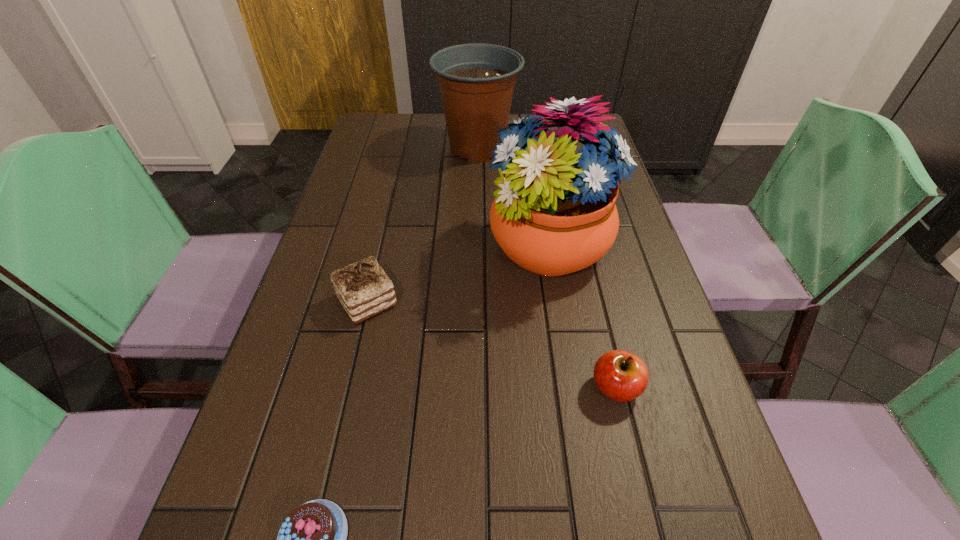
The image size is (960, 540). I want to click on object positioned at the left edge, so click(x=363, y=288).

The image size is (960, 540). I want to click on flower arrangement situated at the right edge, so click(554, 214).

Find the location of `apple that is positioned at the right edge`. apple that is positioned at the right edge is located at coordinates (621, 376).

You are a GUI agent. You are given a task and a screenshot of the screen. Output one action in this format:
    pyautogui.click(x=<x>, y=<y>)
    Task: Click on the vacant space at the far edge of the desktop
    The height and width of the screenshot is (540, 960).
    Given the screenshot: What is the action you would take?
    pyautogui.click(x=427, y=126)

Find the location of a particular element. Image resolution: width=960 pixels, height=540 pixels. free space at the left edge of the desktop is located at coordinates (276, 395).

I want to click on vacant space at the right edge, so click(607, 261).

At what (x,y) coordinates should I click in order to perform the action: click on blank area at the far left corner. Please return your answer as a coordinate pair (x, y). The height and width of the screenshot is (540, 960). Looking at the image, I should click on (412, 126).

Where is `free area in between the taller chocolate cake and the flower arrangement`? The height and width of the screenshot is (540, 960). free area in between the taller chocolate cake and the flower arrangement is located at coordinates (459, 275).

The image size is (960, 540). I want to click on free spot between the taller chocolate cake and the fourth farthest object, so click(x=492, y=345).

Locate an element on the screen. Image resolution: width=960 pixels, height=540 pixels. free space that is in between the tallest object and the apple is located at coordinates (584, 318).